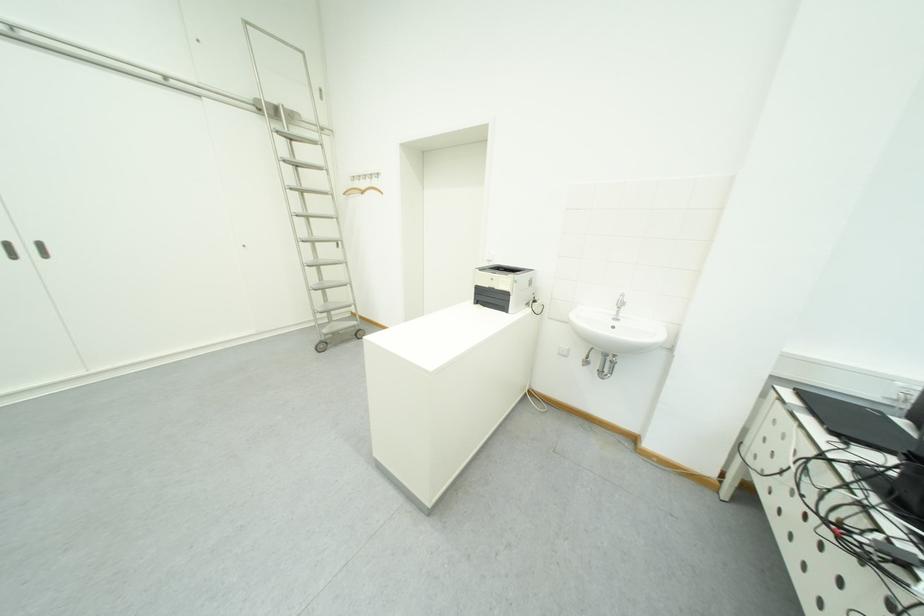
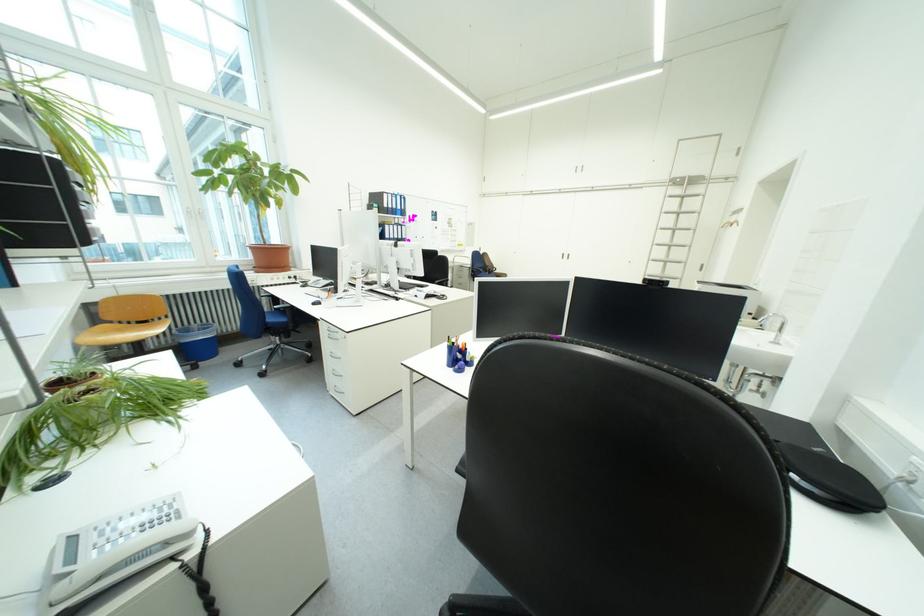
In the second image, find the point that corresponds to point (40, 252) in the first image.

(577, 257)